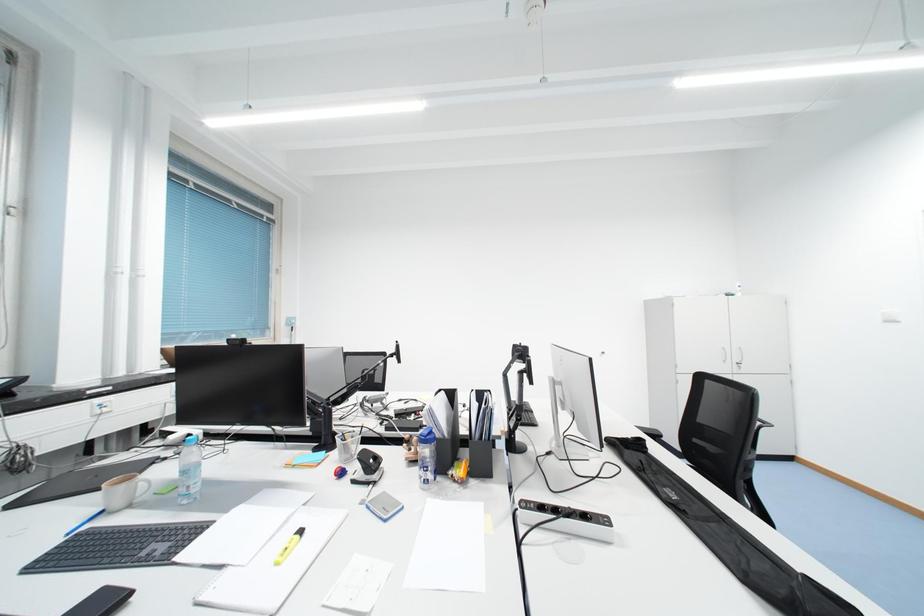
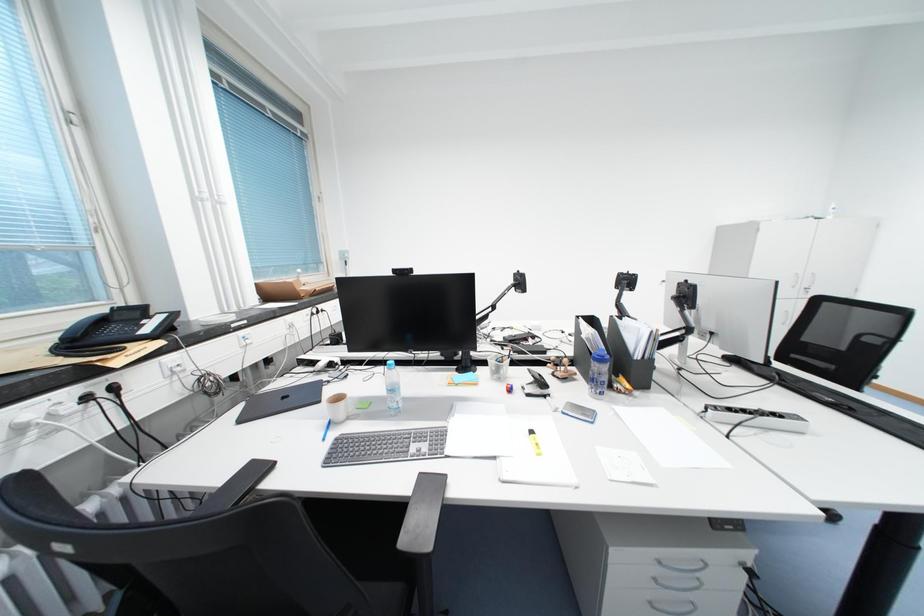
Question: What movement of the cameraman would produce the second image?

Choices:
 (A) Left
 (B) Right
 (C) Forward
 (D) Backward

Answer: (A)